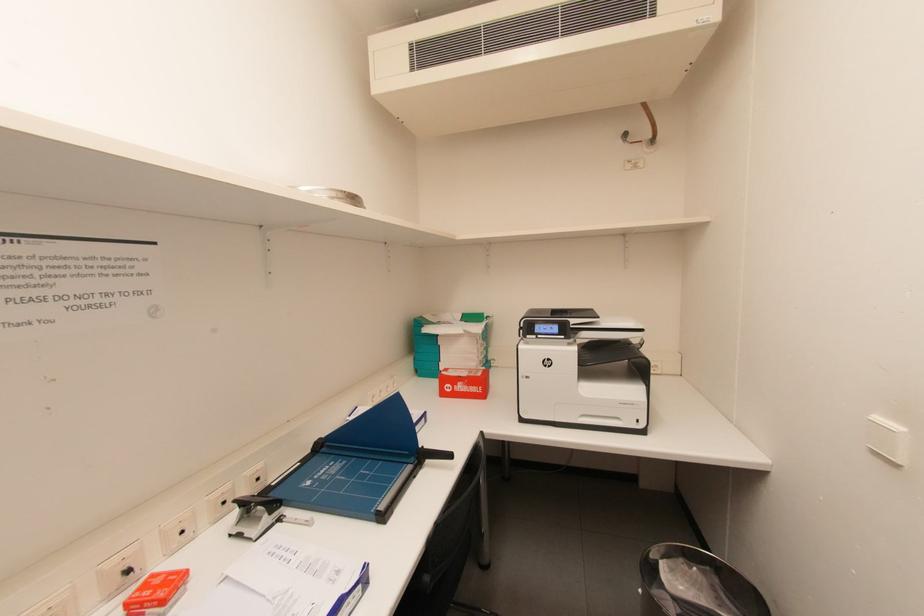
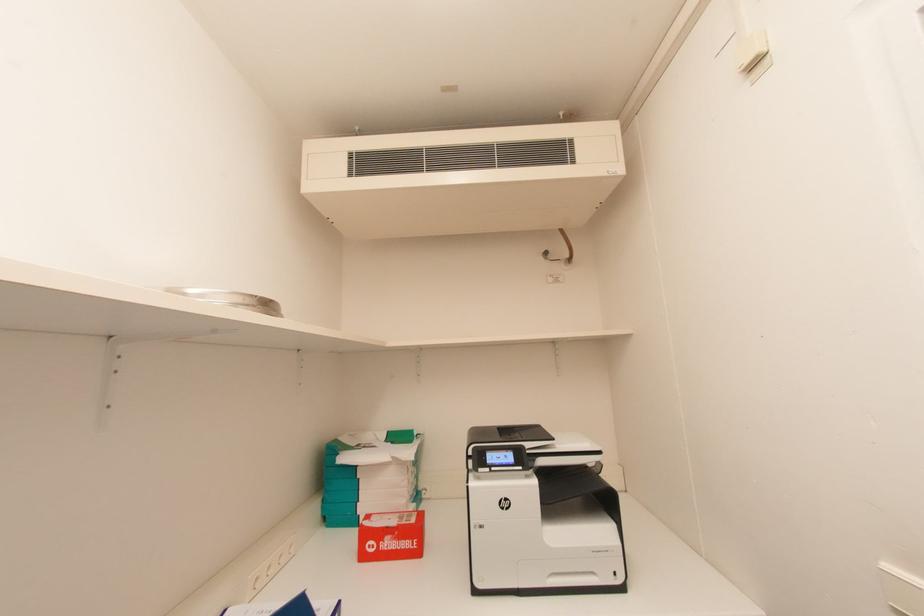
Based on the continuous images, in which direction is the camera rotating?

The camera rotated toward right-up.